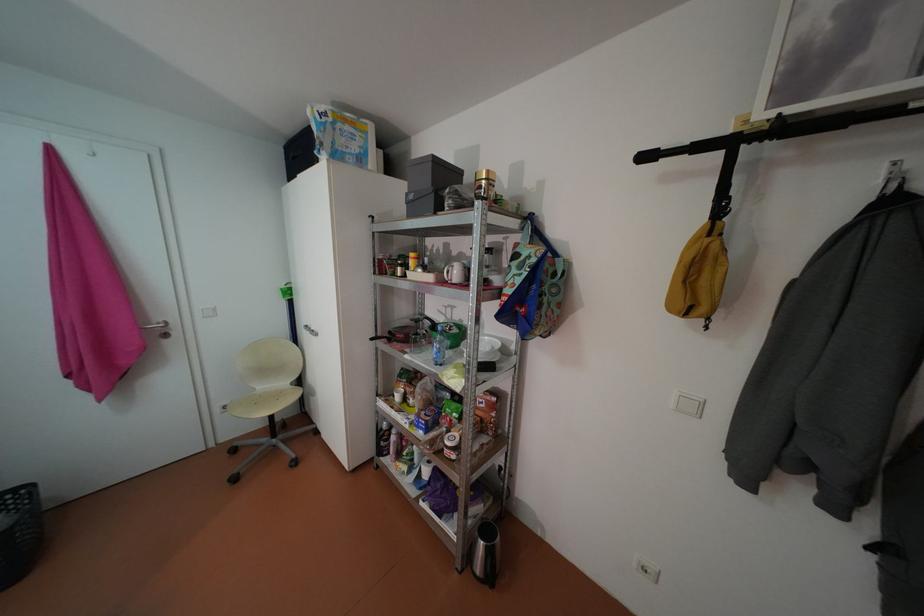
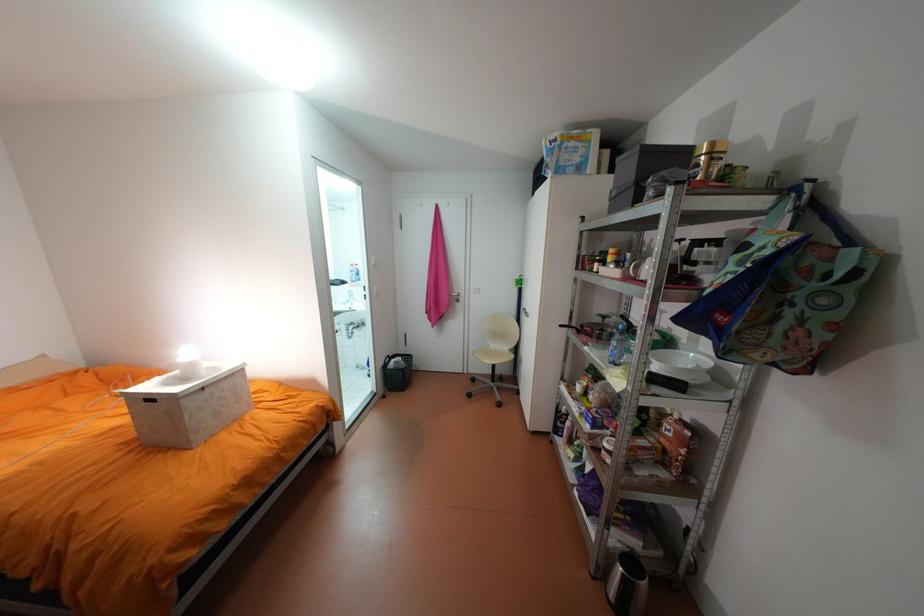
In the second image, find the point that corresponds to pixel 446 345 in the first image.

(624, 342)